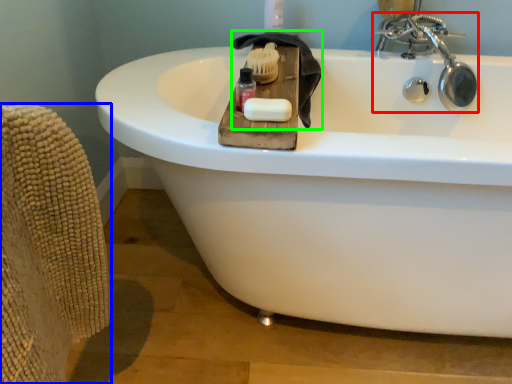
Question: Which object is positioned farthest from tap (highlighted by a red box)? Select from armchair (highlighted by a blue box) and bath towel (highlighted by a green box).

Choices:
 (A) armchair
 (B) bath towel

Answer: (A)